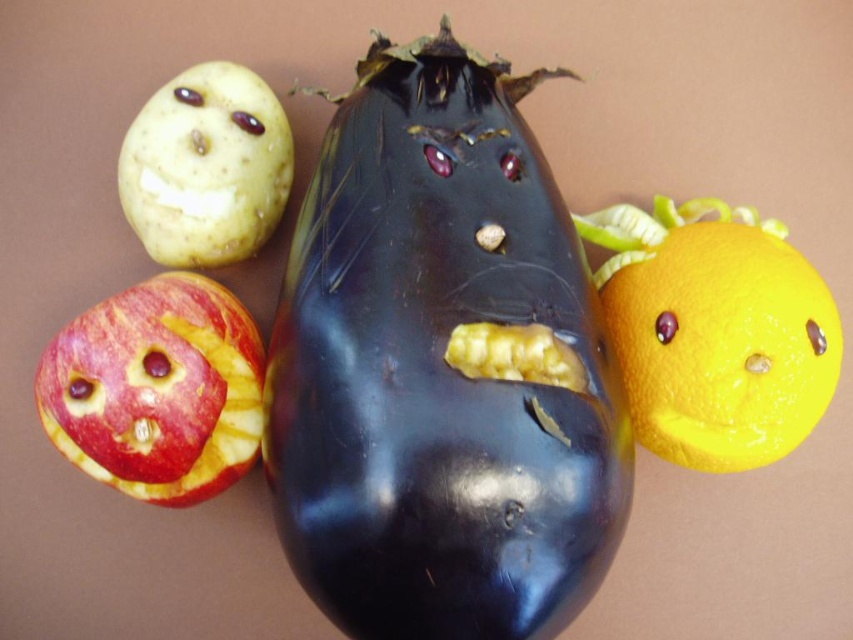
Between point (296, 490) and point (268, 236), which one is positioned behind?

Positioned behind is point (268, 236).

Between point (305, 410) and point (167, 148), which one is positioned in front?

Point (305, 410) is more forward.

Where is `shiny dark purple eggplant at center`? The image size is (853, 640). shiny dark purple eggplant at center is located at coordinates (439, 368).

Measure the distance between smooth red apple at lower left and camera.

1.22 meters

You are a GUI agent. You are given a task and a screenshot of the screen. Output one action in this format:
    pyautogui.click(x=<x>, y=<y>)
    Task: Click on the smooth red apple at lower left
    Image resolution: width=853 pixels, height=640 pixels.
    Given the screenshot: What is the action you would take?
    pyautogui.click(x=157, y=388)

Does shiny dark purple eggplant at center have a greater height compared to smooth red apple at lower left?

Yes.

Can you confirm if shiny dark purple eggplant at center is smaller than smooth red apple at lower left?

Incorrect, shiny dark purple eggplant at center is not smaller in size than smooth red apple at lower left.

Is point (462, 186) positioned behind point (206, 458)?

No, it is not.

Find the location of a particular element. This screenshot has width=853, height=640. shiny dark purple eggplant at center is located at coordinates (439, 368).